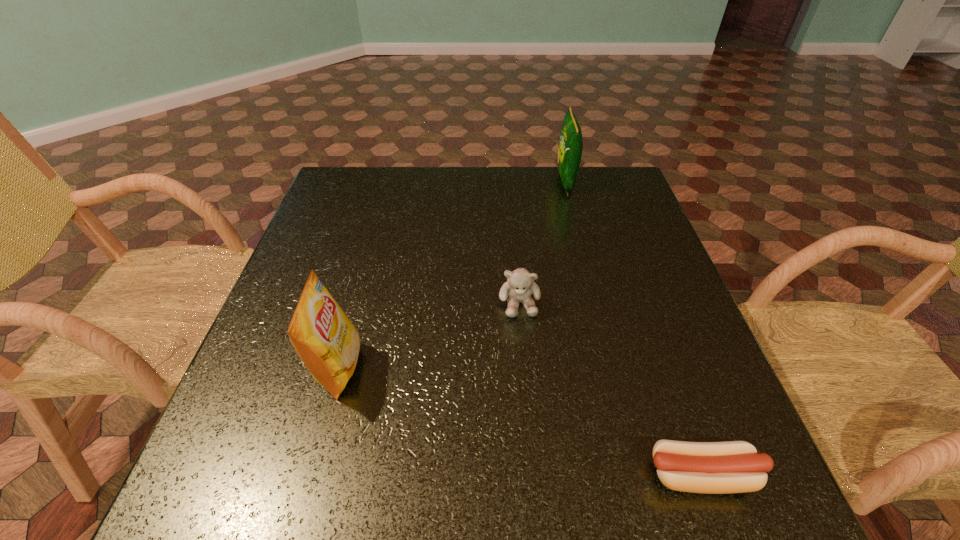
Image resolution: width=960 pixels, height=540 pixels. Find the location of `free space between the second shortest object and the shortest object`. free space between the second shortest object and the shortest object is located at coordinates (611, 389).

Find the location of a particular element. The image size is (960, 540). unoccupied area between the second object from left to right and the nearest object is located at coordinates (611, 389).

Locate an element on the screen. vacant space that is in between the second shortest object and the sausage is located at coordinates (611, 389).

Where is `unoccupied position between the third farthest object and the sausage`? unoccupied position between the third farthest object and the sausage is located at coordinates (520, 421).

The height and width of the screenshot is (540, 960). Find the location of `vacant point located between the shortest object and the teddy bear`. vacant point located between the shortest object and the teddy bear is located at coordinates (611, 389).

Where is `free area in between the third tallest object and the right crisp (potato chip)`? free area in between the third tallest object and the right crisp (potato chip) is located at coordinates (542, 242).

In order to click on the third closest object relative to the farthest object in this screenshot , I will do `click(727, 467)`.

Find the location of a particular element. object that stands as the closest to the shortest object is located at coordinates (520, 285).

I want to click on free region that satisfies the following two spatial constraints: 1. on the front-facing side of the farther crisp (potato chip); 2. on the left side of the sausage, so point(640,475).

Find the location of a particular element. Image resolution: width=960 pixels, height=540 pixels. free location that satisfies the following two spatial constraints: 1. on the face of the teddy bear; 2. on the front-facing side of the nearer crisp (potato chip) is located at coordinates (525, 368).